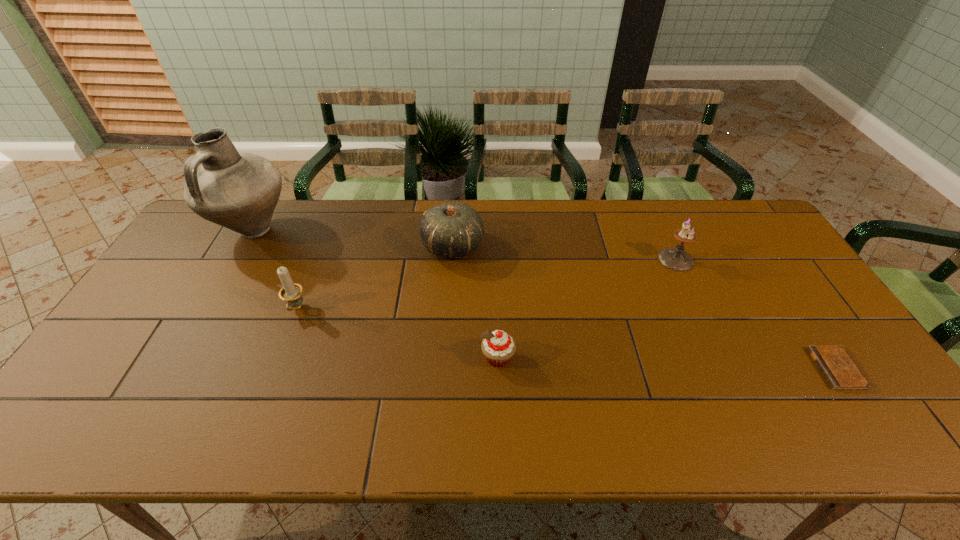
This screenshot has height=540, width=960. What are the coordinates of `vacant space that satisfies the following two spatial constraints: 1. on the handle side of the leftmost object; 2. on the left side of the cupcake` in the screenshot? It's located at (180, 358).

You are a GUI agent. You are given a task and a screenshot of the screen. Output one action in this format:
    pyautogui.click(x=<x>, y=<y>)
    Task: Click on the vacant space that satisfies the following two spatial constraints: 1. on the handle side of the tallest object; 2. on the right side of the gourd
    
    Given the screenshot: What is the action you would take?
    pyautogui.click(x=245, y=246)

Locate an element on the screen. This screenshot has width=960, height=540. vacant space that satisfies the following two spatial constraints: 1. on the handle side of the pitcher; 2. on the left side of the farther candle_holder is located at coordinates (237, 259).

Where is `free space that satisfies the following two spatial constraints: 1. on the handle side of the leftmost object; 2. on the right side of the fifth tallest object`? Image resolution: width=960 pixels, height=540 pixels. free space that satisfies the following two spatial constraints: 1. on the handle side of the leftmost object; 2. on the right side of the fifth tallest object is located at coordinates (180, 358).